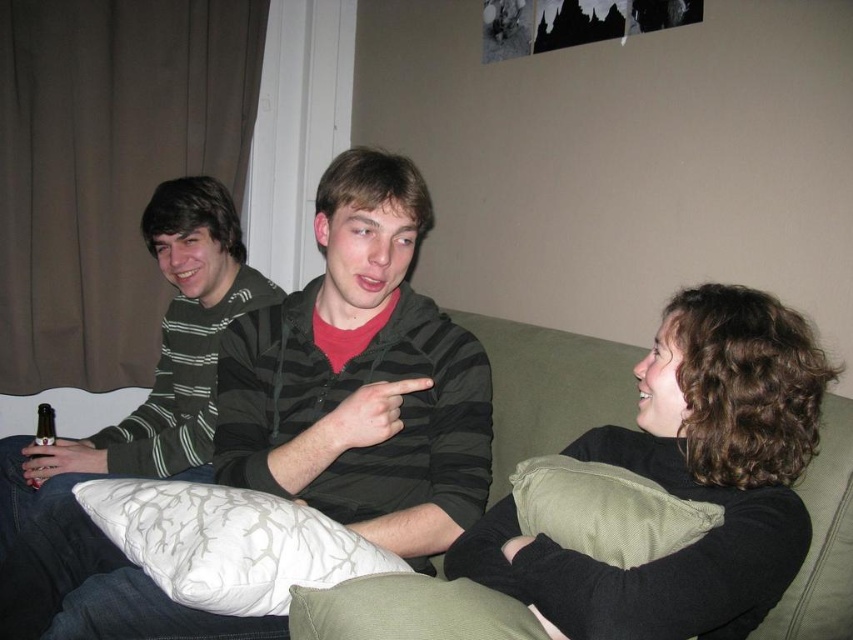
Measure the distance from green fabric couch at center to matte black can at left.

green fabric couch at center is 1.03 meters from matte black can at left.

Where is `green fabric couch at center`? The height and width of the screenshot is (640, 853). green fabric couch at center is located at coordinates (549, 387).

This screenshot has width=853, height=640. I want to click on green fabric couch at center, so click(x=549, y=387).

In the scene shown: Between dark brown curly hair at right and green fabric couch at center, which one appears on the left side from the viewer's perspective?

green fabric couch at center is more to the left.

Between point (523, 566) and point (619, 362), which one is positioned behind?

The point (619, 362) is behind.

Where is `dark brown curly hair at right`? dark brown curly hair at right is located at coordinates (686, 480).

Is point (45, 486) farther from viewer compared to point (38, 440)?

No.

Is striped hoodie at left closer to camera compared to matte black can at left?

That is True.

Locate an element on the screen. striped hoodie at left is located at coordinates (132, 410).